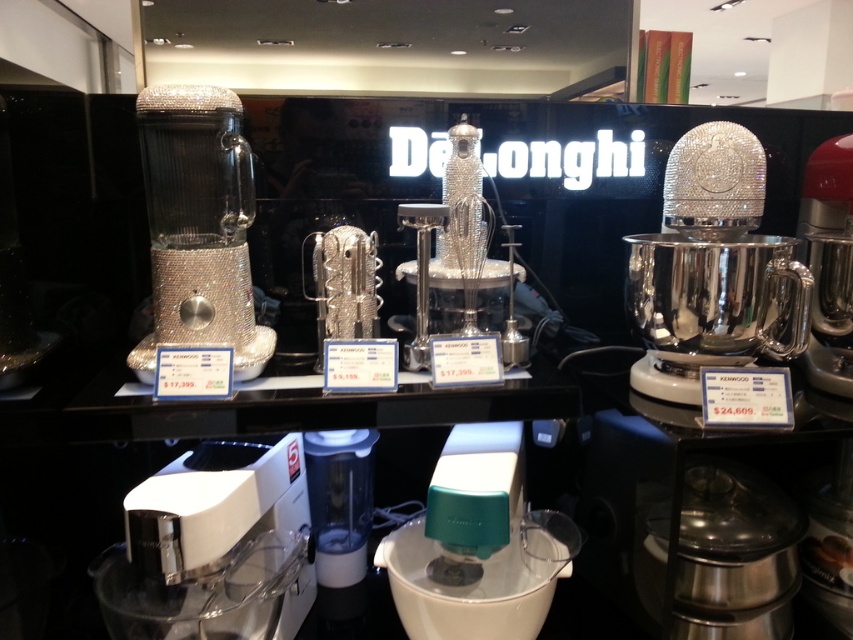
You are a customer in the store looking at the white plastic blender at center and the sparkly silver mixer at center. Which appliance can you see more details of from your current position?

The white plastic blender at center is closer to the viewer, so you can see more details of it compared to the sparkly silver mixer at center.

You are a customer in the store looking at the appliances. You want to place both the white plastic food processor at lower left and the red metallic mixer at right on your kitchen counter. Which appliance will take up more vertical space on your counter?

The red metallic mixer at right is taller than the white plastic food processor at lower left, so it will take up more vertical space on your counter.

You are a delivery person who needs to pack the white plastic food processor at lower left and the red metallic mixer at right into a box that is 18 inches wide. Based on their widths, will both items fit side by side in the box?

The white plastic food processor at lower left might be wider than the red metallic mixer at right, so there is uncertainty whether their combined width would exceed 18 inches. It is possible they may not fit together.